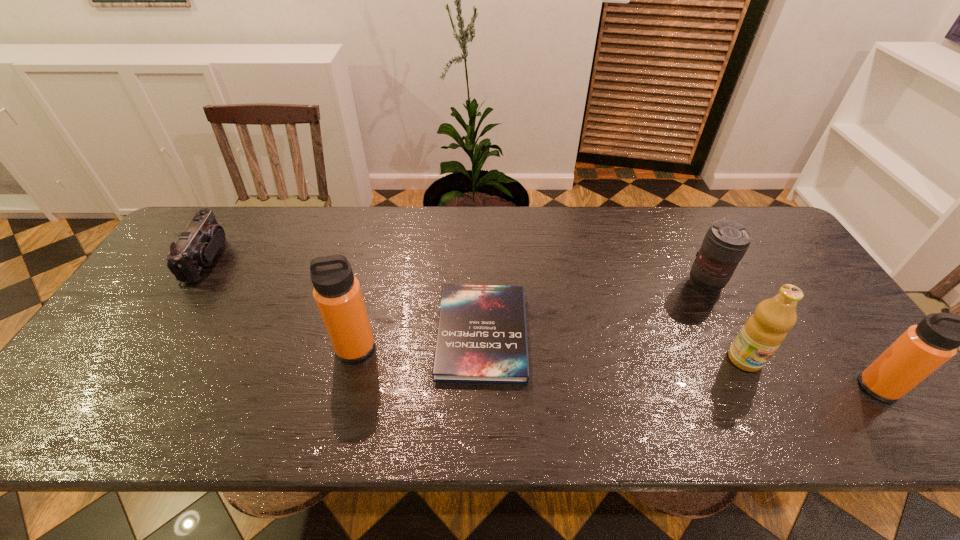
Image resolution: width=960 pixels, height=540 pixels. I want to click on the taller thermos bottle, so click(x=337, y=293).

This screenshot has height=540, width=960. I want to click on the left thermos bottle, so click(x=337, y=293).

You are a GUI agent. You are given a task and a screenshot of the screen. Output one action in this format:
    pyautogui.click(x=<x>, y=<y>)
    Task: Click on the rightmost object
    Image resolution: width=960 pixels, height=540 pixels.
    Given the screenshot: What is the action you would take?
    pyautogui.click(x=922, y=349)

This screenshot has width=960, height=540. In order to click on the right thermos bottle in this screenshot , I will do `click(922, 349)`.

Image resolution: width=960 pixels, height=540 pixels. Identify the location of the leftmost object. [197, 245].

Where is `camcorder`? The image size is (960, 540). camcorder is located at coordinates (197, 245).

At what (x,y) coordinates should I click in order to perform the action: click on the fourth tallest object. Please return your answer as a coordinate pair (x, y). This screenshot has width=960, height=540. Looking at the image, I should click on click(726, 242).

Identify the location of the shortest object. The image size is (960, 540). (482, 337).

Locate an element on the screen. Image resolution: width=960 pixels, height=540 pixels. the fourth object from right to left is located at coordinates (482, 337).

Where is `olive oil`? olive oil is located at coordinates (764, 331).